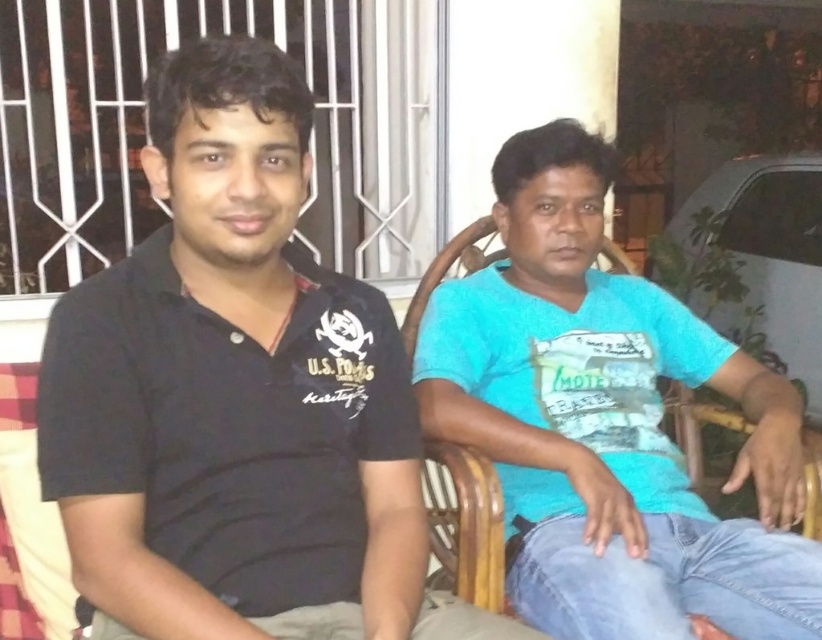
Based on the photo, you are a photographer setting up a shoot on a porch. You have two shirts to place on chairs. The black cotton shirt at left and the blue cotton shirt at center. According to the scene, which shirt is covering part of the other?

The black cotton shirt at left is positioned over the blue cotton shirt at center, meaning it is covering part of the blue cotton shirt at center.

You are a photographer trying to capture a group photo of the two people in the scene. Since you want to ensure both subjects are visible in the frame, which direction should you position the camera relative to the black cotton shirt at left and the blue cotton shirt at center?

You should position the camera to the right side of the blue cotton shirt at center so that both the black cotton shirt at left and the blue cotton shirt at center are visible in the frame, as the black cotton shirt at left is positioned on the left side of the blue cotton shirt at center.

You are a fashion designer observing two shirts in the image. The black cotton shirt at left and the blue cotton shirt at center. Which shirt is smaller in size?

The black cotton shirt at left is smaller than the blue cotton shirt at center.